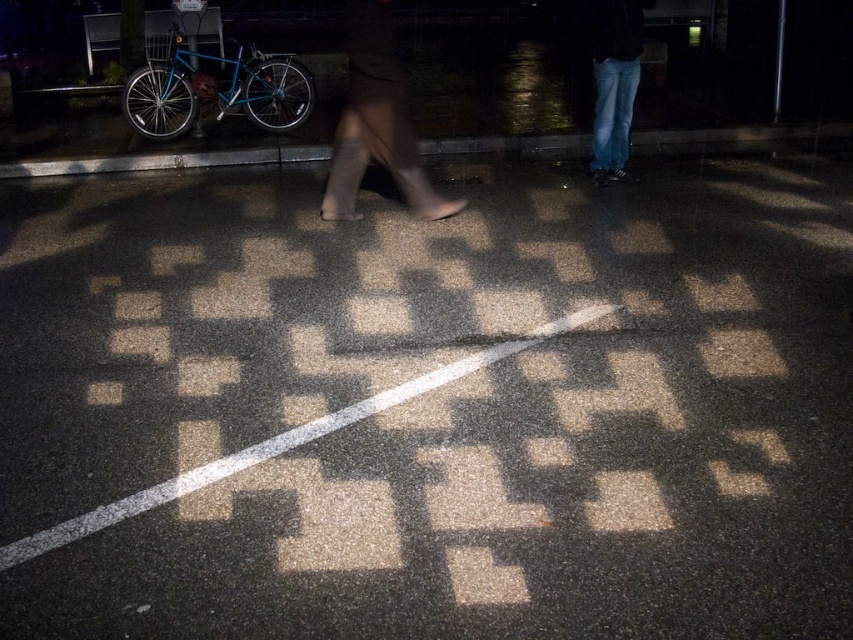
Between point (352, 177) and point (602, 120), which one is positioned behind?

The point (602, 120) is more distant.

Is leather boots at center thinner than jeans at upper right?

Incorrect, leather boots at center's width is not less than jeans at upper right's.

Locate an element on the screen. This screenshot has width=853, height=640. leather boots at center is located at coordinates (376, 122).